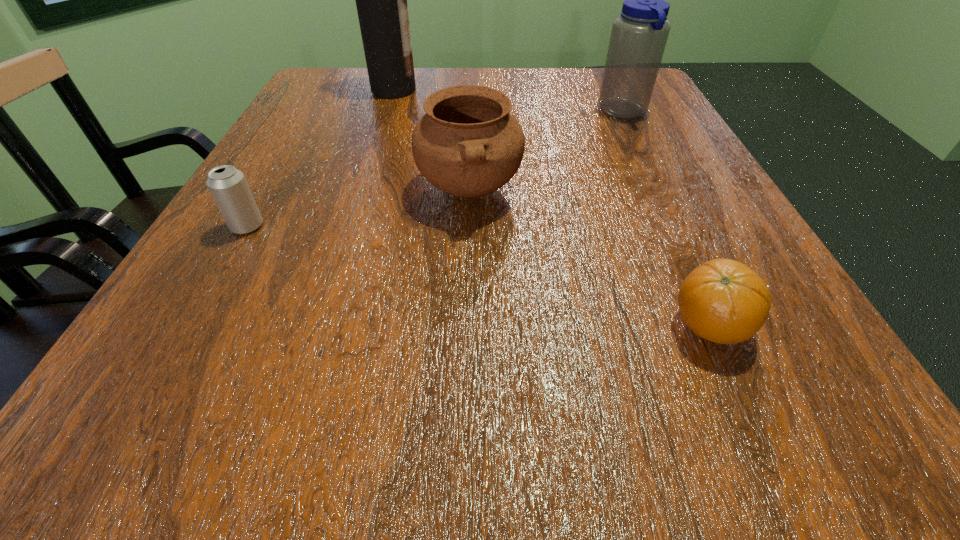
The image size is (960, 540). Identify the location of wine bottle. (381, 0).

Locate an element on the screen. the tallest object is located at coordinates (381, 0).

Where is `water bottle`? The width and height of the screenshot is (960, 540). water bottle is located at coordinates (639, 35).

This screenshot has height=540, width=960. I want to click on the third object from left to right, so click(468, 144).

You are a GUI agent. You are given a task and a screenshot of the screen. Output one action in this format:
    pyautogui.click(x=<x>, y=<y>)
    Task: Click on the pottery
    This screenshot has width=960, height=540.
    Given the screenshot: What is the action you would take?
    pyautogui.click(x=468, y=144)

The height and width of the screenshot is (540, 960). I want to click on beer can, so click(228, 186).

Find the location of a particular element. orange is located at coordinates (724, 301).

Where is `vacant space located 0.350m on the label of the wine bottle`? vacant space located 0.350m on the label of the wine bottle is located at coordinates pyautogui.click(x=568, y=90).

This screenshot has width=960, height=540. I want to click on vacant space located 0.310m with a carrying loop on the side of the water bottle, so [452, 112].

Locate an element on the screen. vacant space located with a carrying loop on the side of the water bottle is located at coordinates (452, 112).